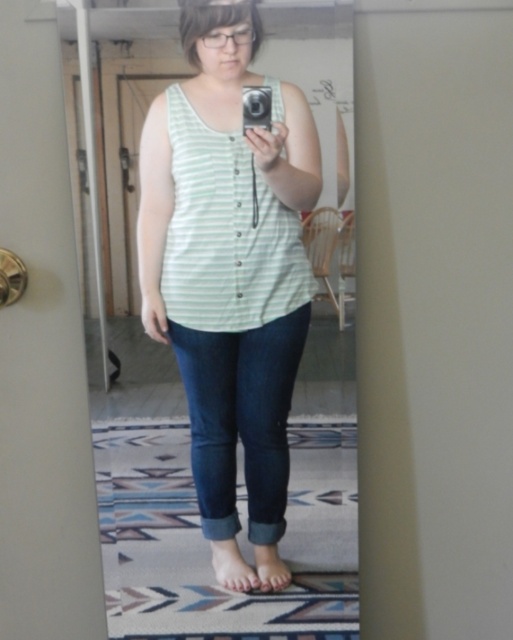
You are a fashion designer analyzing the outfit of the person in the mirror. Based on the image, which clothing item is positioned higher on the body between the light green striped tank top at center and the dark blue denim jeans at lower center?

The light green striped tank top at center is positioned higher on the body than the dark blue denim jeans at lower center, as it is taller in the image.

You are a fashion designer analyzing the outfit in the image. The person is wearing a green striped tank top at center and dark blue denim jeans at lower center. Which piece of clothing is wider?

The green striped tank top at center is wider than the dark blue denim jeans at lower center.